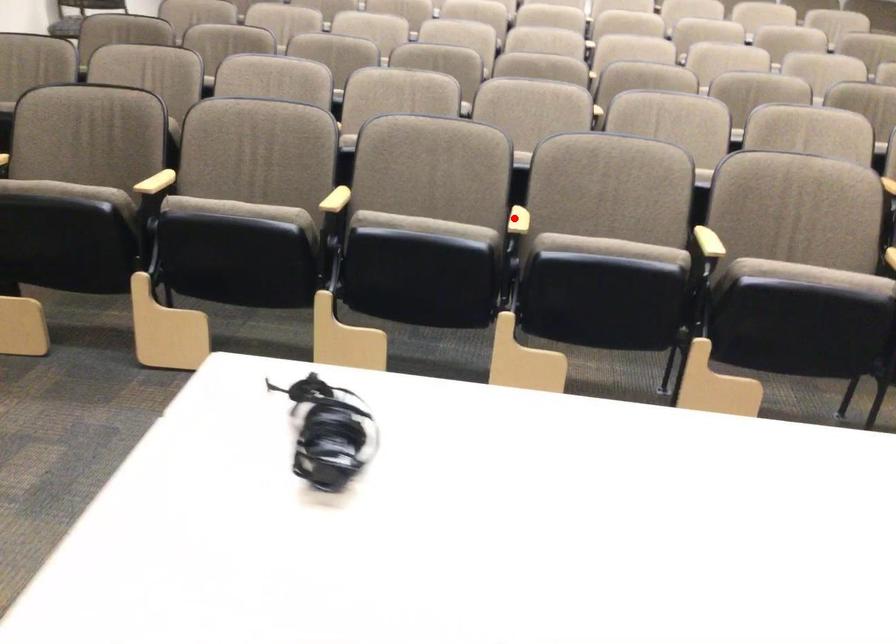
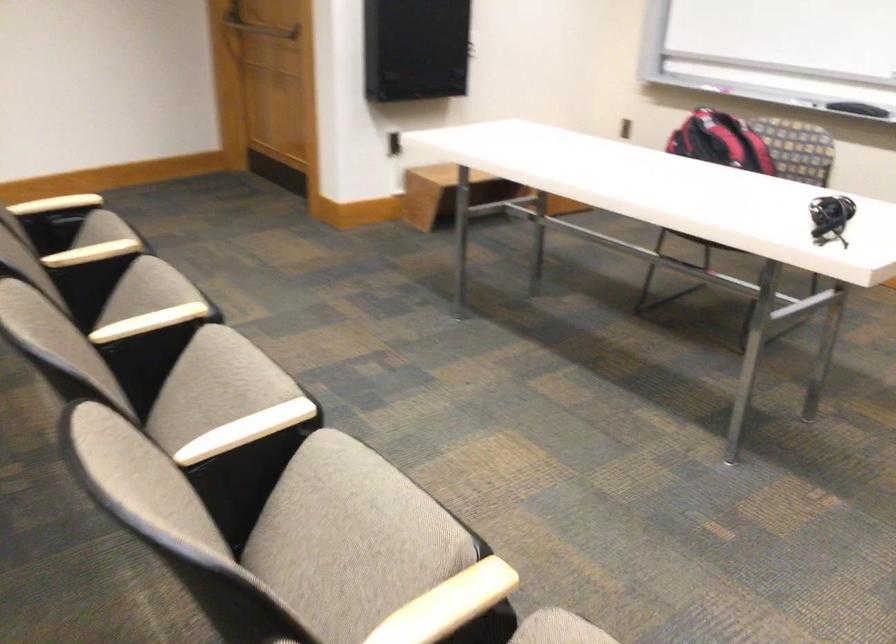
Where in the second image is the point corresponding to the highlighted location from the first image?

(245, 430)